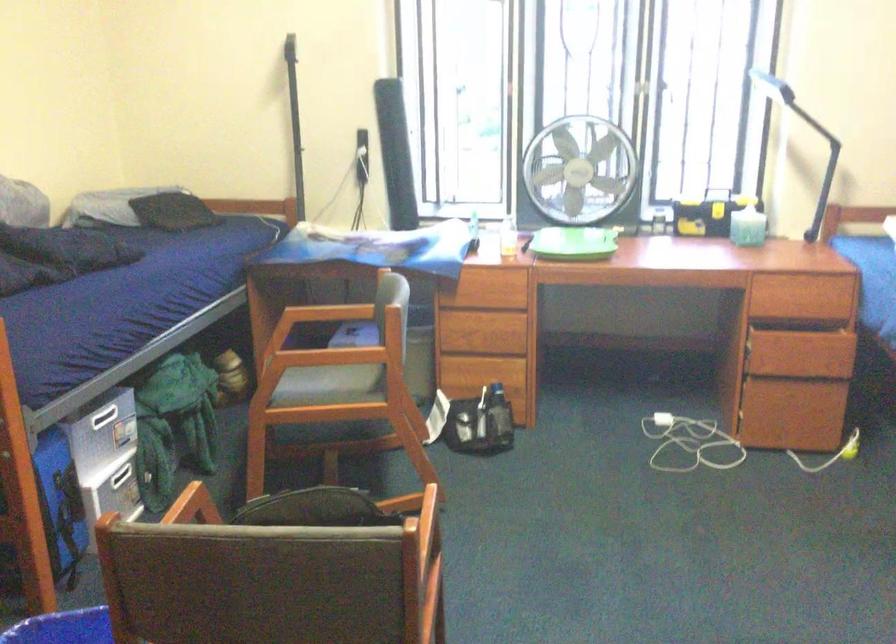
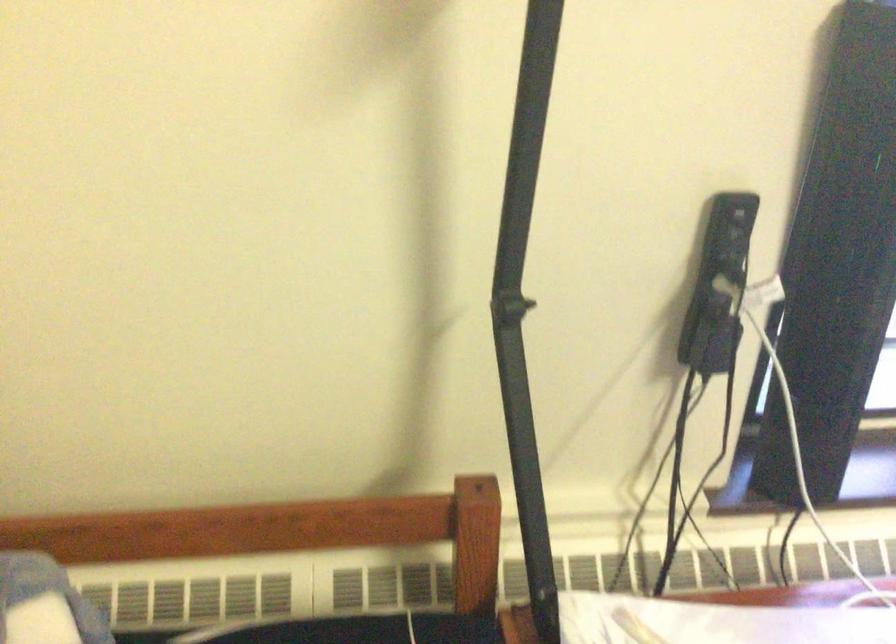
In the second image, find the point that corresponds to the point at 367,144 in the first image.

(718, 285)